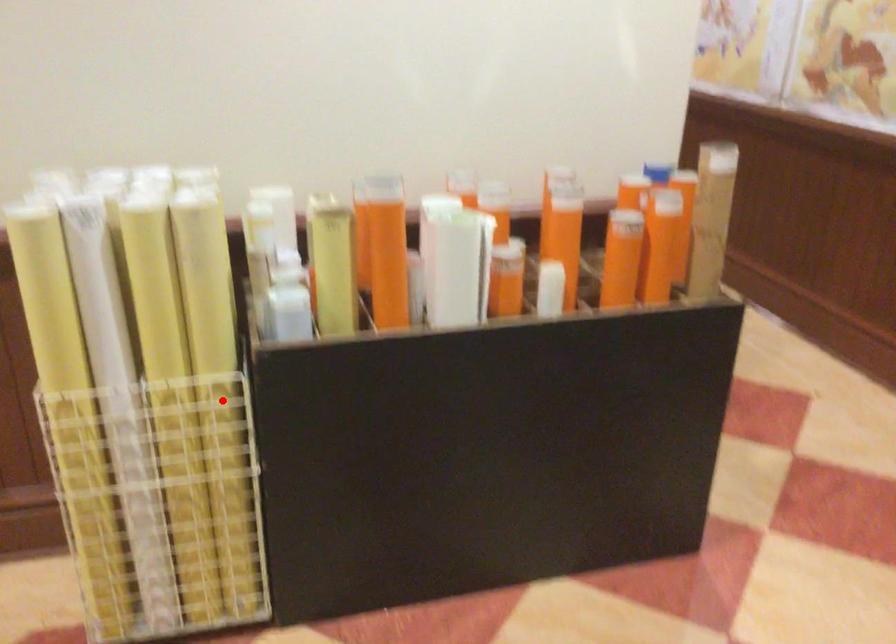
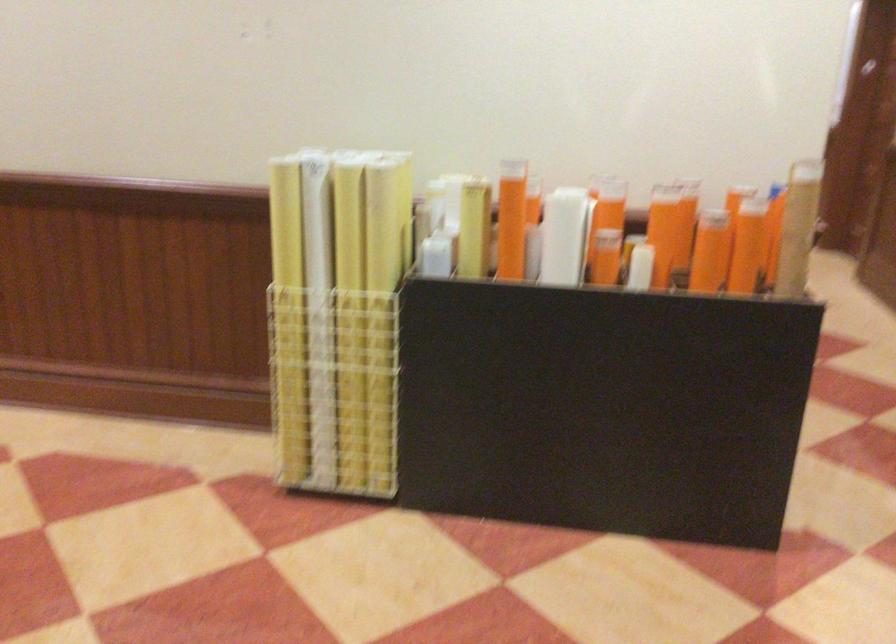
Question: A red point is marked in image1. In image2, is the corresponding 3D point closer to the camera or farther? Reply with the corresponding letter.

Choices:
 (A) The corresponding 3D point is closer.
 (B) The corresponding 3D point is farther.

Answer: (B)